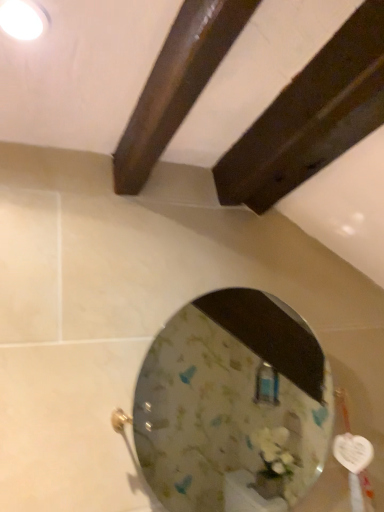
Question: Relative to clear glass mirror at center, is white glossy light fixture at upper left in front or behind?

Choices:
 (A) behind
 (B) front

Answer: (B)

Question: From a real-world perspective, is white glossy light fixture at upper left above or below clear glass mirror at center?

Choices:
 (A) above
 (B) below

Answer: (A)

Question: From their relative heights in the image, would you say white glossy light fixture at upper left is taller or shorter than clear glass mirror at center?

Choices:
 (A) tall
 (B) short

Answer: (B)

Question: From the image's perspective, relative to white glossy light fixture at upper left, is clear glass mirror at center above or below?

Choices:
 (A) above
 (B) below

Answer: (B)

Question: Is clear glass mirror at center spatially inside white glossy light fixture at upper left, or outside of it?

Choices:
 (A) inside
 (B) outside

Answer: (B)

Question: In terms of height, does clear glass mirror at center look taller or shorter compared to white glossy light fixture at upper left?

Choices:
 (A) short
 (B) tall

Answer: (B)

Question: Is clear glass mirror at center in front of or behind white glossy light fixture at upper left in the image?

Choices:
 (A) behind
 (B) front

Answer: (A)